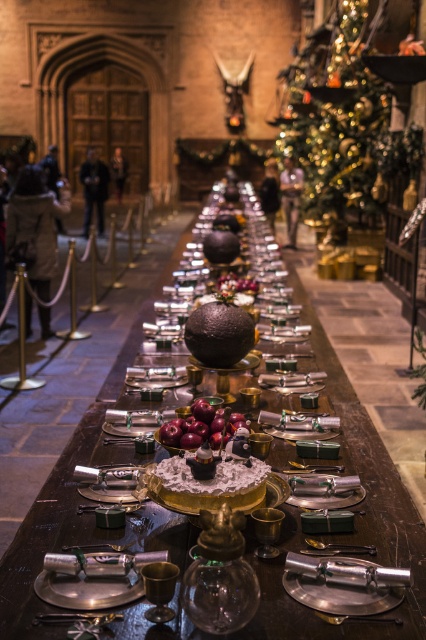
Question: Which of these objects is positioned farthest from the shiny red apples at center?

Choices:
 (A) shiny chocolate sphere at center
 (B) shiny silver table at center
 (C) gold glittering christmas tree at upper right

Answer: (C)

Question: Which object appears closest to the camera in this image?

Choices:
 (A) gold glittering christmas tree at upper right
 (B) shiny red apples at center
 (C) shiny chocolate sphere at center
 (D) shiny silver table at center

Answer: (D)

Question: Which of the following is the closest to the observer?

Choices:
 (A) shiny red apples at center
 (B) shiny chocolate sphere at center
 (C) gold glittering christmas tree at upper right

Answer: (A)

Question: Can you confirm if shiny silver table at center is positioned to the right of shiny red apples at center?

Choices:
 (A) no
 (B) yes

Answer: (A)

Question: Where is shiny silver table at center located in relation to shiny chocolate sphere at center in the image?

Choices:
 (A) above
 (B) below

Answer: (B)

Question: Is gold glittering christmas tree at upper right below shiny red apples at center?

Choices:
 (A) yes
 (B) no

Answer: (B)